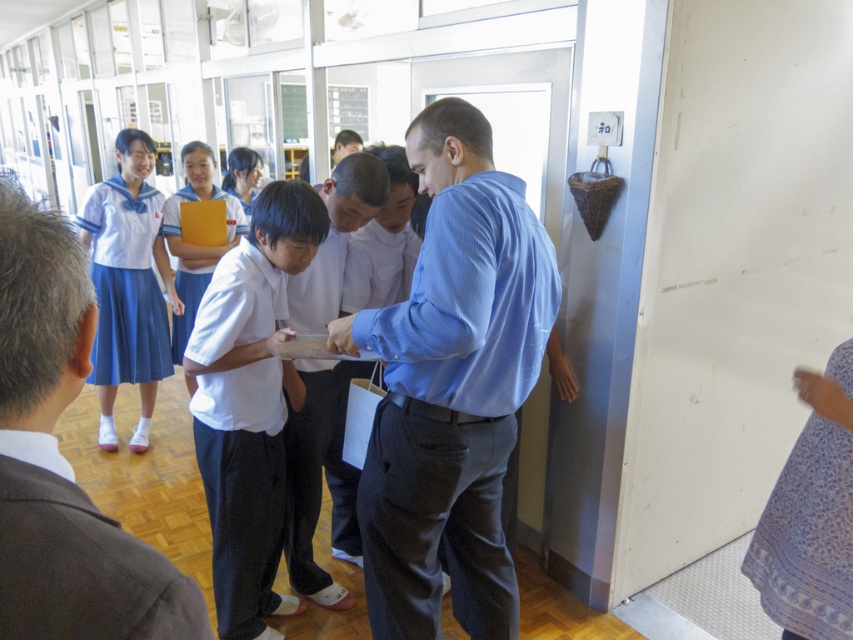
Is point (387, 492) positioned in front of point (99, 365)?

Yes, point (387, 492) is in front of point (99, 365).

Between blue striped shirt at center and white uniform skirt at left, which one appears on the right side from the viewer's perspective?

From the viewer's perspective, blue striped shirt at center appears more on the right side.

Does point (485, 557) lie behind point (112, 316)?

No, (485, 557) is in front of (112, 316).

Locate an element on the screen. blue striped shirt at center is located at coordinates (451, 387).

Does white cotton school uniform at lower left appear on the right side of light blue striped shirt at center?

Yes, white cotton school uniform at lower left is to the right of light blue striped shirt at center.

Is white cotton school uniform at lower left taller than light blue striped shirt at center?

Incorrect, white cotton school uniform at lower left's height is not larger of light blue striped shirt at center's.

Measure the distance between white cotton school uniform at lower left and camera.

white cotton school uniform at lower left and camera are 19.05 inches apart.

The width and height of the screenshot is (853, 640). I want to click on white cotton school uniform at lower left, so click(x=79, y=560).

Which is in front, point (125, 356) or point (207, 276)?

Point (125, 356) is more forward.

Between point (126, 172) and point (187, 339), which one is positioned behind?

The point (187, 339) is more distant.

Which is in front, point (91, 269) or point (167, 236)?

Point (91, 269) is in front.

Where is `white uniform skirt at left`? The image size is (853, 640). white uniform skirt at left is located at coordinates [128, 284].